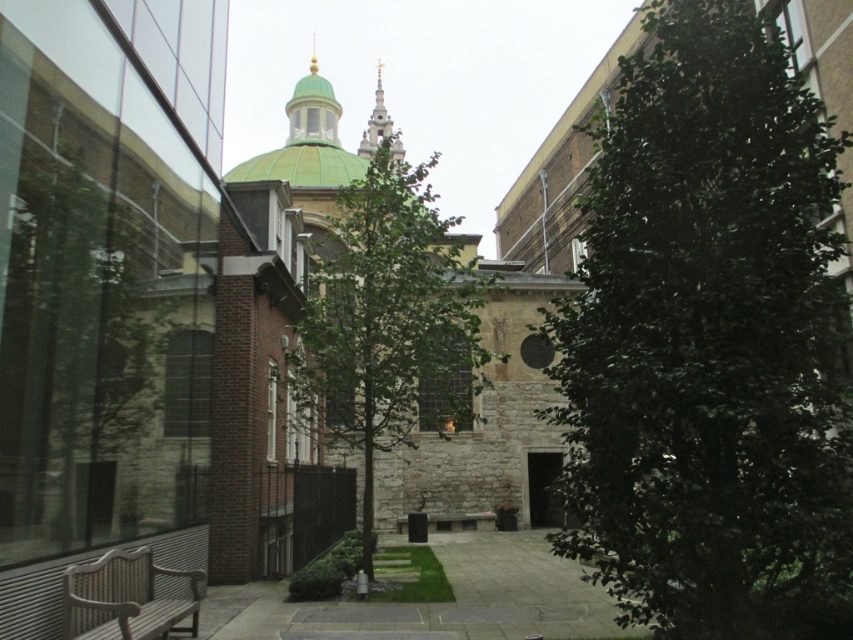
Question: Does green stone church at center have a greater width compared to green dome at upper center?

Choices:
 (A) yes
 (B) no

Answer: (A)

Question: Which object appears closest to the camera in this image?

Choices:
 (A) paved stone path at center
 (B) green leafy tree at right
 (C) green stone church at center
 (D) gold textured spire at upper center

Answer: (B)

Question: From the image, what is the correct spatial relationship of green leafy tree at right in relation to green dome at upper center?

Choices:
 (A) below
 (B) above

Answer: (A)

Question: Based on their relative distances, which object is farther from the paved stone path at center?

Choices:
 (A) wooden bench at lower left
 (B) gold textured spire at upper center
 (C) green leafy tree at right
 (D) green dome at upper center

Answer: (B)

Question: Is wooden bench at lower left positioned in front of green dome at upper center?

Choices:
 (A) no
 (B) yes

Answer: (B)

Question: Which of the following is the farthest from the observer?

Choices:
 (A) (608, 356)
 (B) (311, 205)
 (C) (380, 289)

Answer: (B)